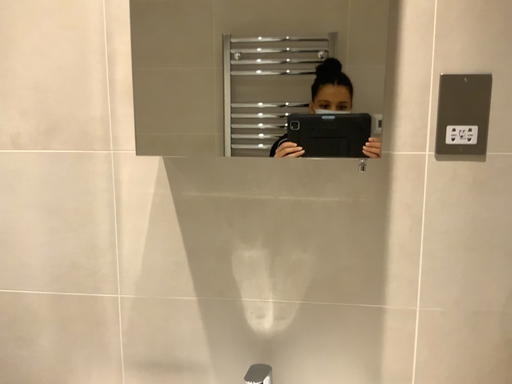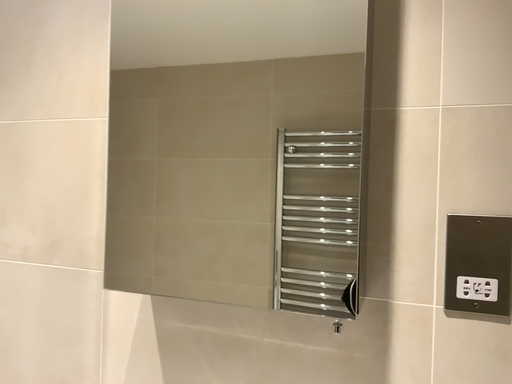
Question: How did the camera likely rotate when shooting the video?

Choices:
 (A) rotated downward
 (B) rotated upward

Answer: (B)